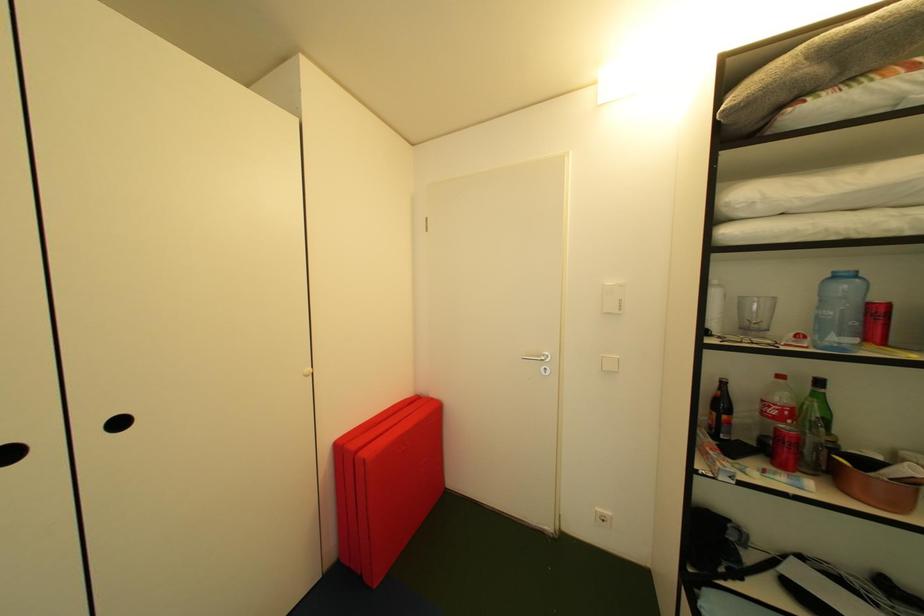
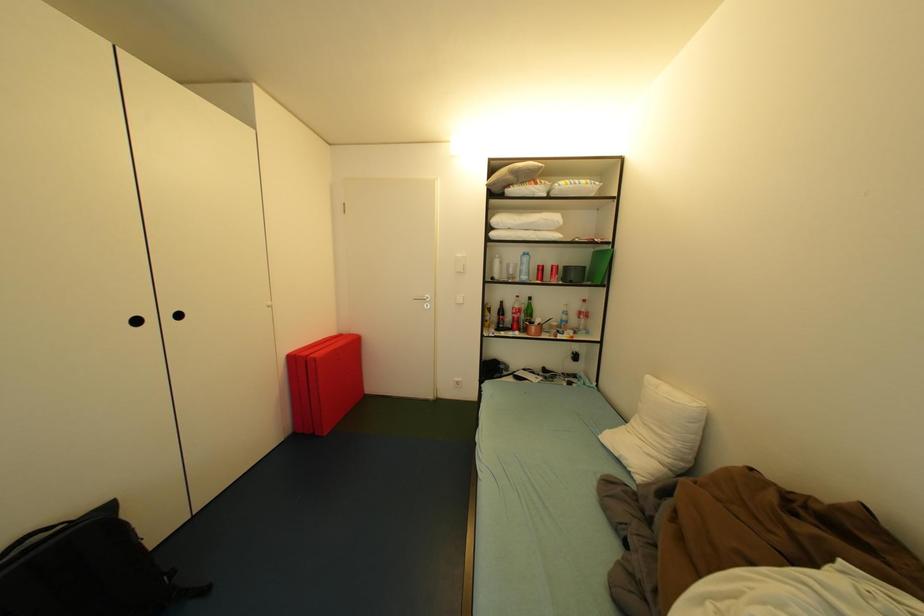
Question: Based on the continuous images, in which direction is the camera rotating? Reply with the corresponding letter.

Choices:
 (A) Left
 (B) Right
 (C) Up
 (D) Down

Answer: (B)